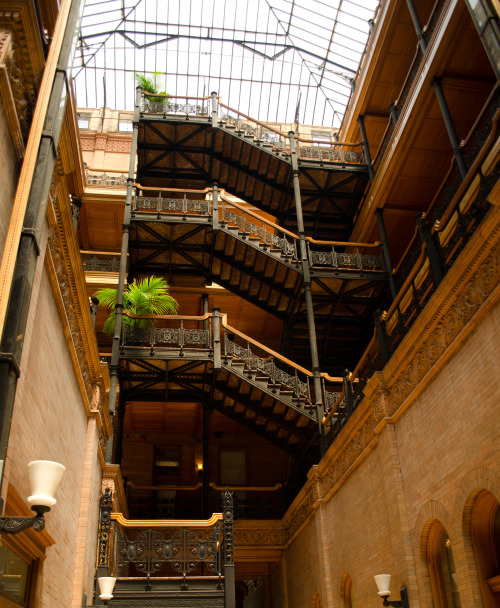
Find the location of `lighting`. lighting is located at coordinates (40, 485), (102, 585), (384, 586).